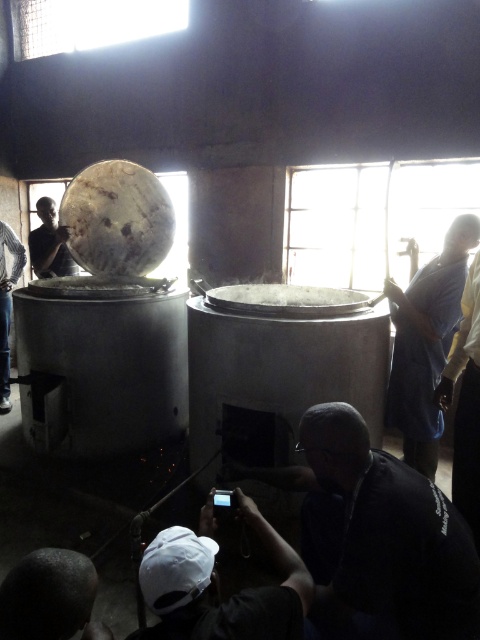
Question: Which point is farther to the camera?

Choices:
 (A) blue fabric shirt at right
 (B) matte black drum at upper left

Answer: (B)

Question: Does dark skin head at lower left appear on the left side of dark blue shirt at lower left?

Choices:
 (A) yes
 (B) no

Answer: (B)

Question: Among these objects, which one is nearest to the camera?

Choices:
 (A) dark skin head at lower left
 (B) matte black drum at upper left
 (C) dark blue shirt at lower center
 (D) blue fabric shirt at right

Answer: (A)

Question: Is blue fabric shirt at right bigger than dark blue shirt at lower left?

Choices:
 (A) yes
 (B) no

Answer: (A)

Question: Estimate the real-world distances between objects in this image. Which object is closer to the dark blue shirt at lower left?

Choices:
 (A) white matte cap at lower center
 (B) matte black drum at upper left

Answer: (B)

Question: Is white matte cap at lower center further to the viewer compared to blue fabric shirt at right?

Choices:
 (A) yes
 (B) no

Answer: (B)